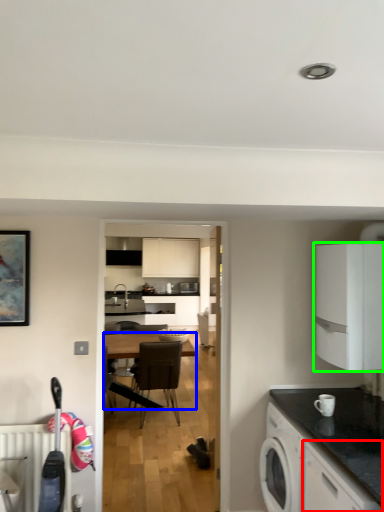
Question: Which object is positioned closest to cabinetry (highlighted by a red box)? Select from desk (highlighted by a blue box) and cabinetry (highlighted by a green box).

Choices:
 (A) desk
 (B) cabinetry

Answer: (B)